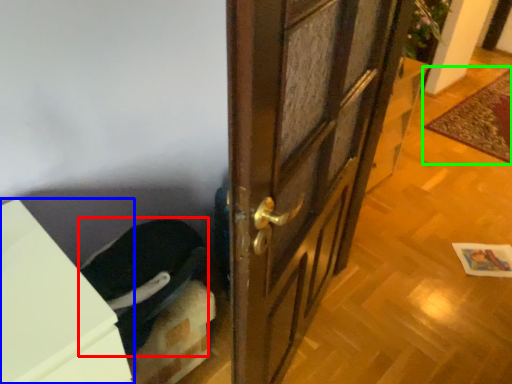
Question: Which is nearer to the laundry (highlighted by a red box)? cabinetry (highlighted by a blue box) or doormat (highlighted by a green box).

Choices:
 (A) cabinetry
 (B) doormat

Answer: (A)